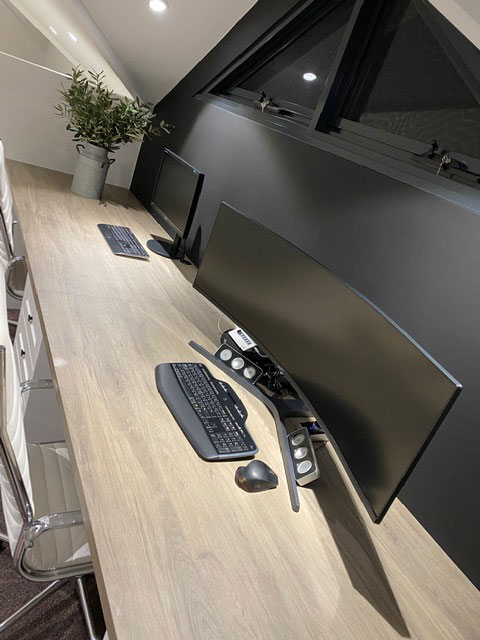
Locate an element on the screen. This screenshot has height=640, width=480. pewter vase is located at coordinates (90, 171).